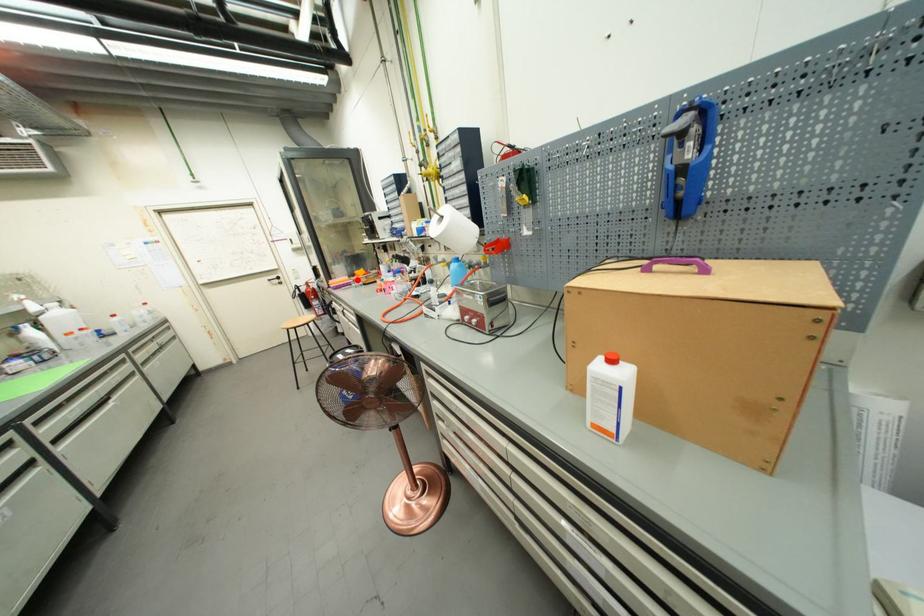
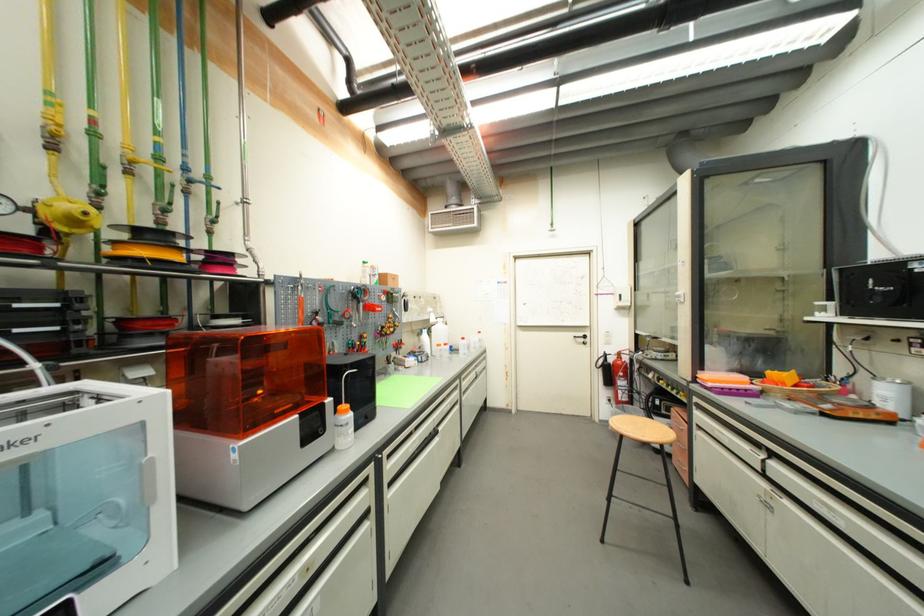
Locate, in the second image, the point that corresponds to the highlighted location in the first image.

(761, 383)